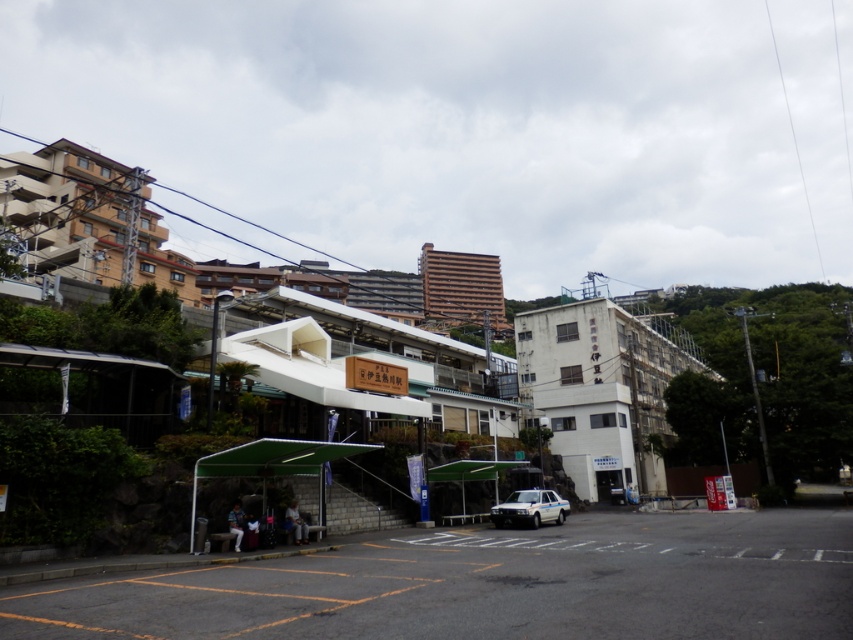
Does white glossy sedan at center appear on the left side of blue denim jeans at lower left?

Incorrect, white glossy sedan at center is not on the left side of blue denim jeans at lower left.

Is point (494, 516) positioned before point (241, 540)?

No, it is not.

Is point (549, 518) closer to viewer compared to point (239, 550)?

No, (549, 518) is behind (239, 550).

Where is `white glossy sedan at center`? white glossy sedan at center is located at coordinates (529, 508).

In the scene shown: Who is more distant from viewer, (x=305, y=531) or (x=238, y=504)?

Positioned behind is point (x=305, y=531).

Which is in front, point (291, 509) or point (233, 513)?

Point (233, 513) is in front.

Locate an element on the screen. The width and height of the screenshot is (853, 640). dark blue fabric jacket at lower center is located at coordinates (294, 524).

Is white glossy sedan at center positioned at the back of dark blue fabric jacket at lower center?

Yes.

Is white glossy sedan at center to the right of dark blue fabric jacket at lower center from the viewer's perspective?

Indeed, white glossy sedan at center is positioned on the right side of dark blue fabric jacket at lower center.

Is point (514, 515) behind point (294, 522)?

That is True.

Locate an element on the screen. Image resolution: width=853 pixels, height=640 pixels. white glossy sedan at center is located at coordinates (529, 508).